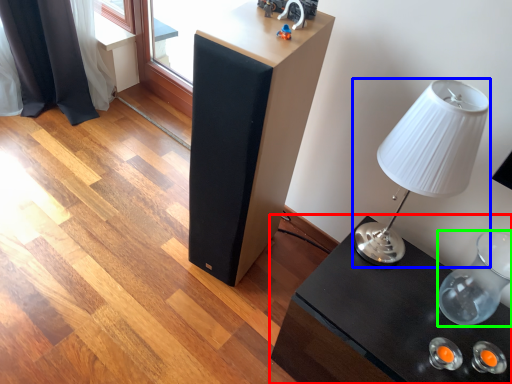
Question: Which object is the farthest from table (highlighted by a red box)? Choose among these: lamp (highlighted by a blue box) or glass vase (highlighted by a green box).

Choices:
 (A) lamp
 (B) glass vase

Answer: (A)